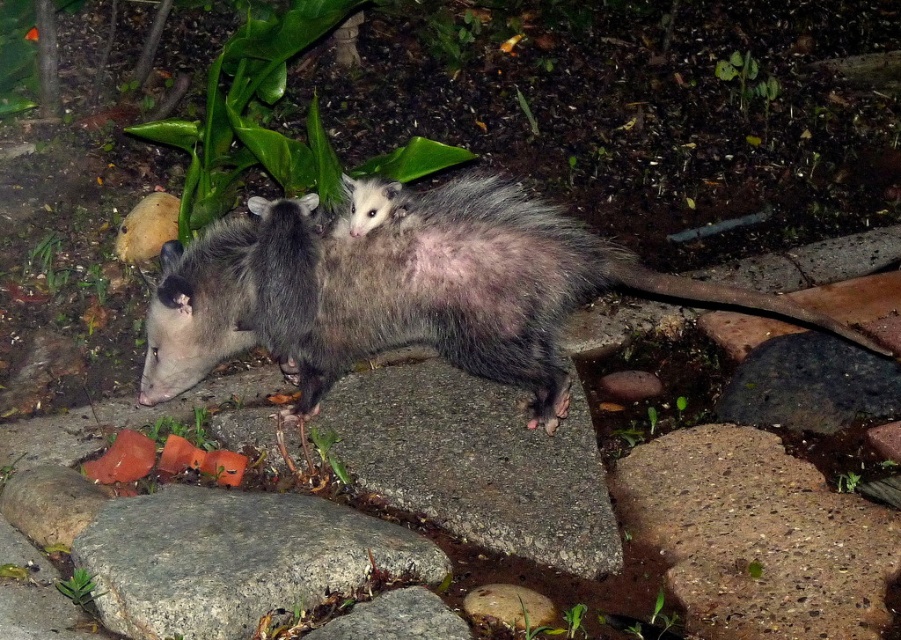
Between gray rough stone at center and smooth orange slices at lower left, which one appears on the right side from the viewer's perspective?

From the viewer's perspective, gray rough stone at center appears more on the right side.

Is point (220, 630) positioned after point (132, 472)?

No, (220, 630) is closer to viewer.

The width and height of the screenshot is (901, 640). What do you see at coordinates (235, 557) in the screenshot? I see `gray rough stone at center` at bounding box center [235, 557].

The width and height of the screenshot is (901, 640). In order to click on gray rough stone at center in this screenshot , I will do `click(235, 557)`.

Does gray rough stone at center appear over gray smooth rock at center?

Indeed, gray rough stone at center is positioned over gray smooth rock at center.

Image resolution: width=901 pixels, height=640 pixels. I want to click on gray rough stone at center, so click(x=235, y=557).

Which is in front, point (117, 593) or point (429, 632)?

Point (429, 632) is in front.

In order to click on gray rough stone at center in this screenshot , I will do `click(235, 557)`.

Is fuzzy gray opossum at center above smooth orange slices at lower left?

Yes, fuzzy gray opossum at center is above smooth orange slices at lower left.

Does fuzzy gray opossum at center have a lesser width compared to smooth orange slices at lower left?

In fact, fuzzy gray opossum at center might be wider than smooth orange slices at lower left.

Locate an element on the screen. fuzzy gray opossum at center is located at coordinates (403, 291).